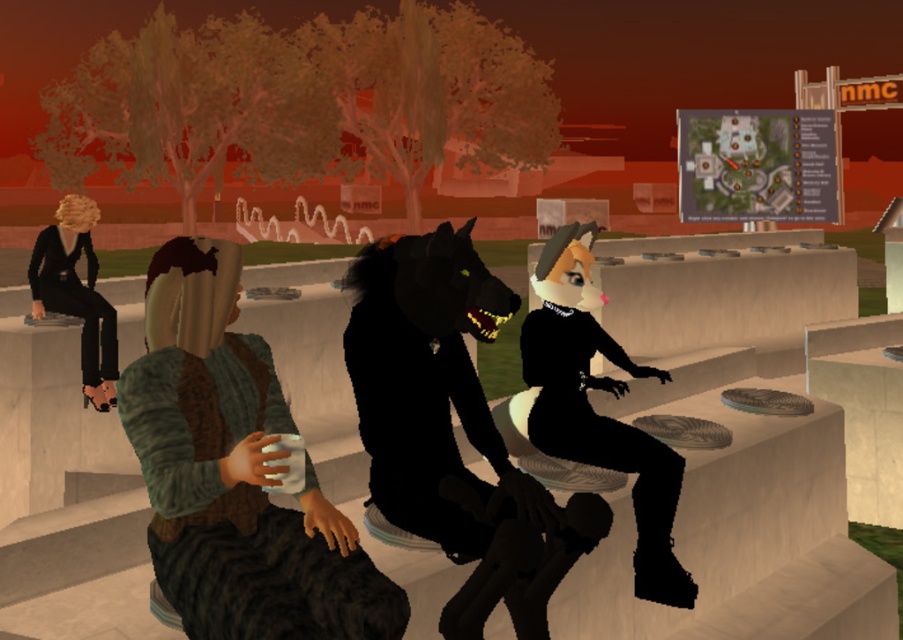
You are a character in this scene and want to hand a treat to both the black matte wolf at center and the black matte cat at center. Which one should you approach first to reach them without moving around the stone structure?

You should approach the black matte wolf at center first since it is closer to you than the black matte cat at center, so you can reach it without needing to move around the stone structure.

You are a game developer designing a new level where the black matte cat at center and the shiny black fur at center must be placed on a narrow platform. Which of the two requires a wider space to accommodate its width?

The black matte cat at center requires a wider space since its width surpasses that of the shiny black fur at center.

You are navigating a virtual environment and need to locate the black matte wolf at center. Based on the coordinates provided in the scene description, can you determine its position relative to the other characters?

The black matte wolf at center is located at coordinates point (430, 385), which places it centrally among the characters on the tiered stone structure.